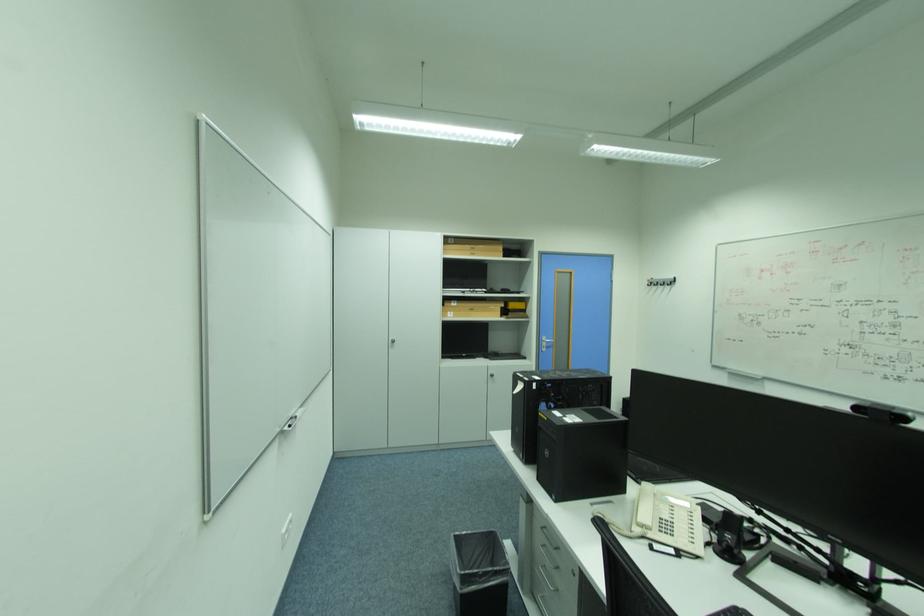
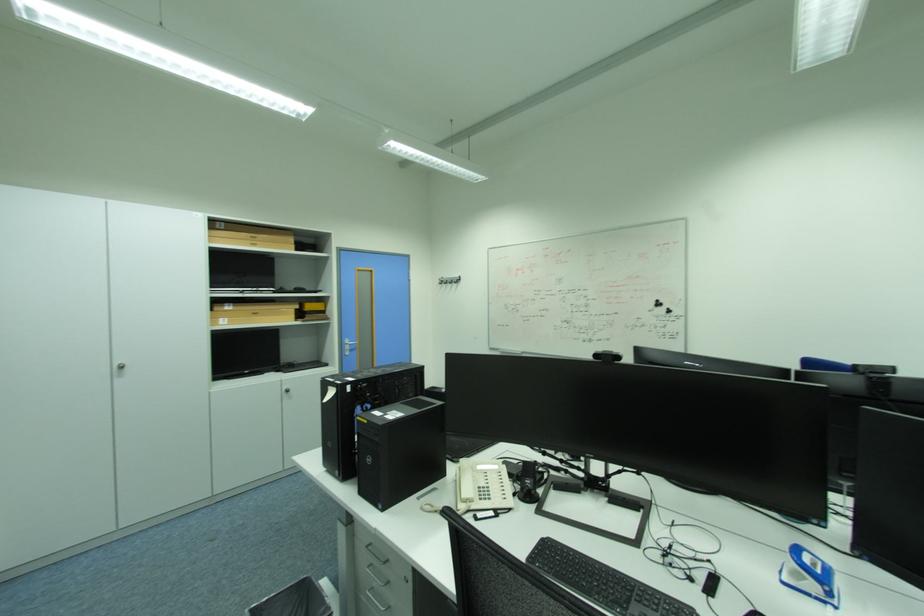
In the second image, find the point that corresponds to point (647, 521) in the first image.

(470, 496)